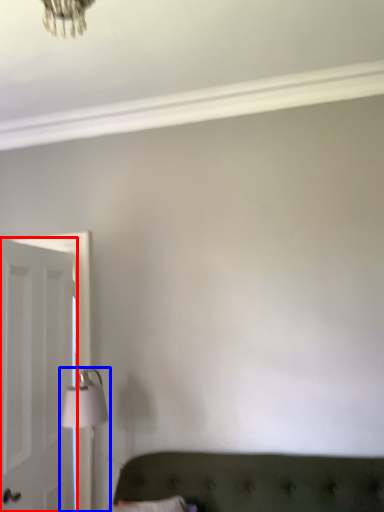
Question: Which point is further to the camera, door (highlighted by a red box) or table lamp (highlighted by a blue box)?

Choices:
 (A) door
 (B) table lamp

Answer: (B)